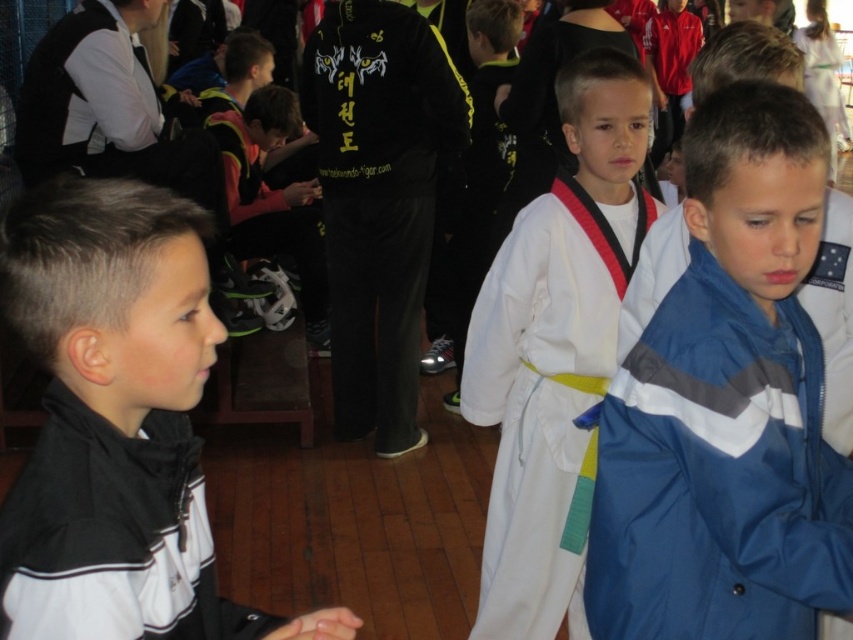
Question: Is velvet black robe at center above black/white jacket at left?

Choices:
 (A) yes
 (B) no

Answer: (A)

Question: Does blue nylon jacket at center have a greater width compared to white cotton karate gi at center?

Choices:
 (A) no
 (B) yes

Answer: (A)

Question: Which point appears closest to the camera in this image?

Choices:
 (A) (531, 376)
 (B) (100, 529)
 (C) (844, 528)
 (D) (392, 284)

Answer: (B)

Question: Among these objects, which one is farthest from the camera?

Choices:
 (A) black/white jacket at left
 (B) black matte jacket at left
 (C) blue nylon jacket at center

Answer: (C)

Question: Which is farther from the black matte jacket at left?

Choices:
 (A) black/white jacket at left
 (B) blue nylon jacket at center
 (C) velvet black robe at center

Answer: (C)

Question: Is black matte jacket at left in front of velvet black robe at center?

Choices:
 (A) no
 (B) yes

Answer: (B)